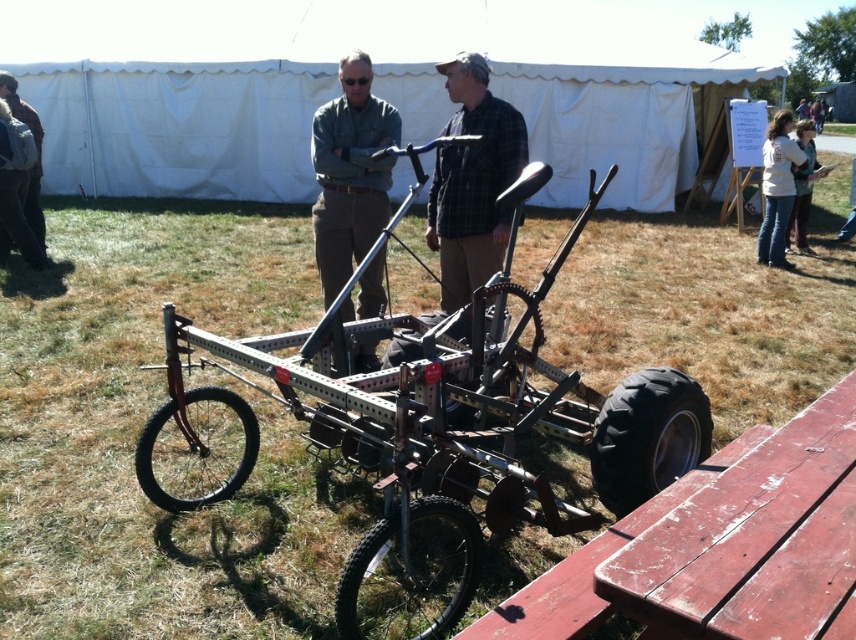
You are a photographer trying to capture both the plaid fabric shirt at center and the white cotton shirt at right in a single shot. Based on their heights, which shirt should you focus on to ensure both are in frame?

The plaid fabric shirt at center is taller than the white cotton shirt at right, so focusing on the plaid fabric shirt at center will help ensure both are in frame as it occupies more vertical space.

You are a farmer trying to park your metallic frame tricycle at center next to a white cotton shirt at upper right. Can the tricycle fit next to the shirt without overlapping?

The metallic frame tricycle at center is wider than the white cotton shirt at upper right, so it can fit next to it without overlapping as long as there is enough space between them.

You are a tailor observing the two men in the scene. You need to determine which man is wearing a wider shirt between the plaid fabric shirt at center and the white cotton shirt at right. Which one should you approach to measure for alterations?

The plaid fabric shirt at center has a larger width than the white cotton shirt at right, so you should approach the man wearing the plaid fabric shirt at center to measure for alterations.